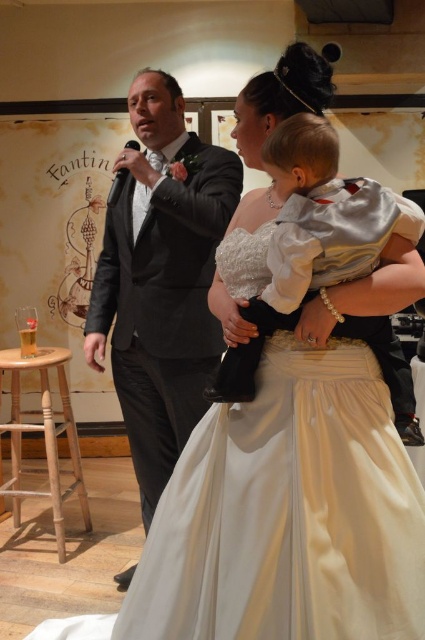
Who is positioned more to the right, white satin baby at center or light brown wooden stool at lower left?

Positioned to the right is white satin baby at center.

Describe the element at coordinates (311, 237) in the screenshot. Image resolution: width=425 pixels, height=640 pixels. I see `white satin baby at center` at that location.

In order to click on white satin baby at center in this screenshot , I will do `click(311, 237)`.

Based on the photo, between matte black suit at center and light brown wooden stool at lower left, which one has less height?

light brown wooden stool at lower left is shorter.

Between matte black suit at center and light brown wooden stool at lower left, which one is positioned higher?

matte black suit at center is above.

I want to click on matte black suit at center, so click(x=161, y=280).

Is matte black suit at center positioned at the back of white satin baby at center?

Yes.

Measure the distance between matte black suit at center and camera.

matte black suit at center and camera are 2.00 meters apart.

In order to click on matte black suit at center in this screenshot , I will do `click(161, 280)`.